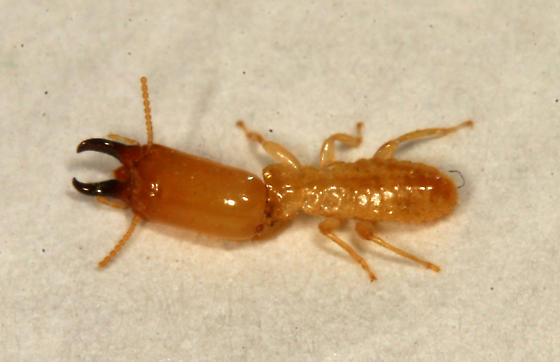
The width and height of the screenshot is (560, 362). Identify the location of light reflections. (232, 206), (245, 197), (382, 200).